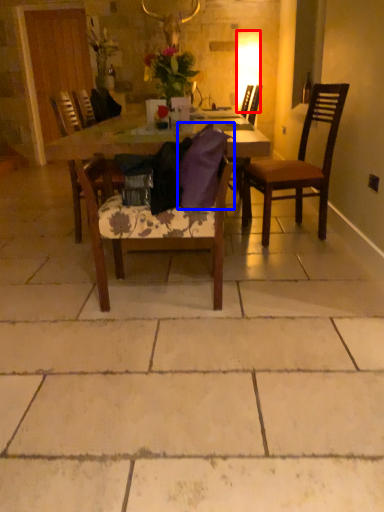
Question: Which object appears closest to the camera in this image, lamp (highlighted by a red box) or pillow (highlighted by a blue box)?

Choices:
 (A) lamp
 (B) pillow

Answer: (B)